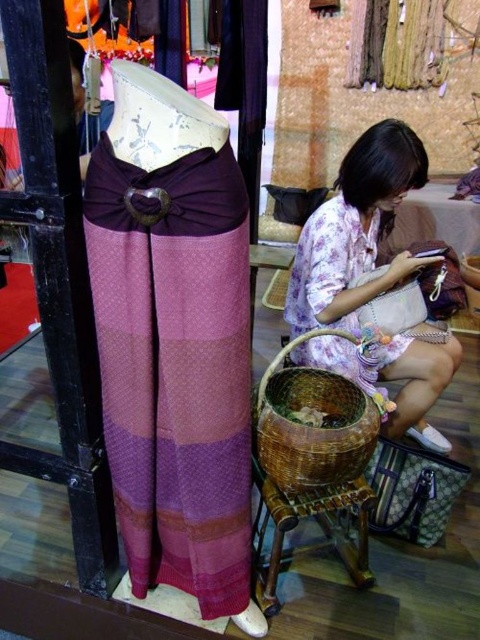
Does floral fabric dress at lower right have a greater height compared to brown woven basket at lower center?

Correct, floral fabric dress at lower right is much taller as brown woven basket at lower center.

Does floral fabric dress at lower right have a lesser height compared to brown woven basket at lower center?

No, floral fabric dress at lower right is not shorter than brown woven basket at lower center.

Does point (322, 307) come closer to viewer compared to point (292, 468)?

No, (322, 307) is behind (292, 468).

At what (x,y) coordinates should I click in order to perform the action: click on floral fabric dress at lower right. Please return your answer as a coordinate pair (x, y). Image resolution: width=480 pixels, height=640 pixels. Looking at the image, I should click on (356, 228).

Is brown woven basket at lower center above brown woven stool at lower center?

Yes, brown woven basket at lower center is above brown woven stool at lower center.

Which is more to the left, brown woven basket at lower center or brown woven stool at lower center?

brown woven stool at lower center

Which is in front, point (275, 360) or point (285, 529)?

Positioned in front is point (285, 529).

Identify the location of brown woven basket at lower center. (312, 422).

Does floral fabric dress at lower right come behind brown woven stool at lower center?

That is True.

Does floral fabric dress at lower right have a greater height compared to brown woven stool at lower center?

Correct, floral fabric dress at lower right is much taller as brown woven stool at lower center.

Find the location of a particular element. floral fabric dress at lower right is located at coordinates (356, 228).